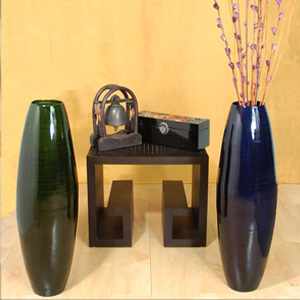
This screenshot has height=300, width=300. In order to click on tall vases in this screenshot , I will do click(45, 178), click(254, 181).